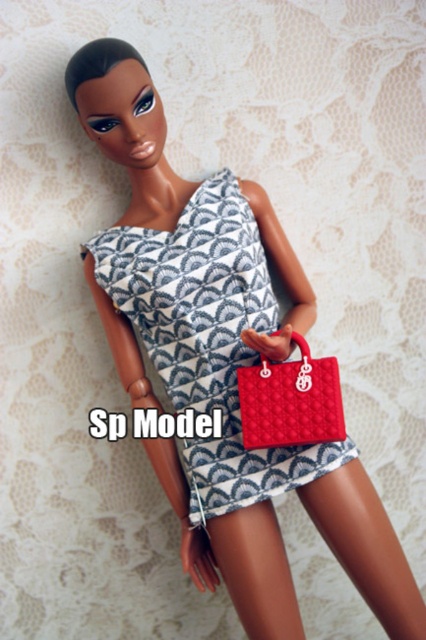
Who is lower down, patterned fabric dress at center or matte red handbag at lower right?

matte red handbag at lower right

Can you confirm if patterned fabric dress at center is positioned below matte red handbag at lower right?

No.

Between point (127, 227) and point (316, 364), which one is positioned behind?

The point (127, 227) is behind.

Where is `patterned fabric dress at center`? patterned fabric dress at center is located at coordinates (207, 337).